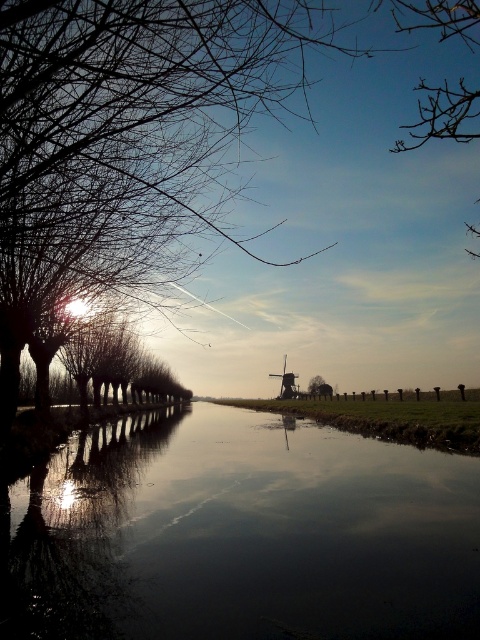
You are a photographer planning to capture the dark reflective water at center and the wooden windmill at center in a single shot. Which object will occupy more space in your photo?

The dark reflective water at center is bigger than the wooden windmill at center, so it will occupy more space in the photo.

You are standing on the bank of the waterway and want to take a photo that includes both the dark reflective water at center and the wooden windmill at center. Based on their positions, which object should you position closer to the bottom of your camera frame?

The wooden windmill at center should be positioned closer to the bottom of your camera frame because the dark reflective water at center is above it.

You are standing at the center of the image and want to reach the dark reflective water at center. In which direction should you move?

The dark reflective water at center is already at the center point, so you don not need to move any direction.